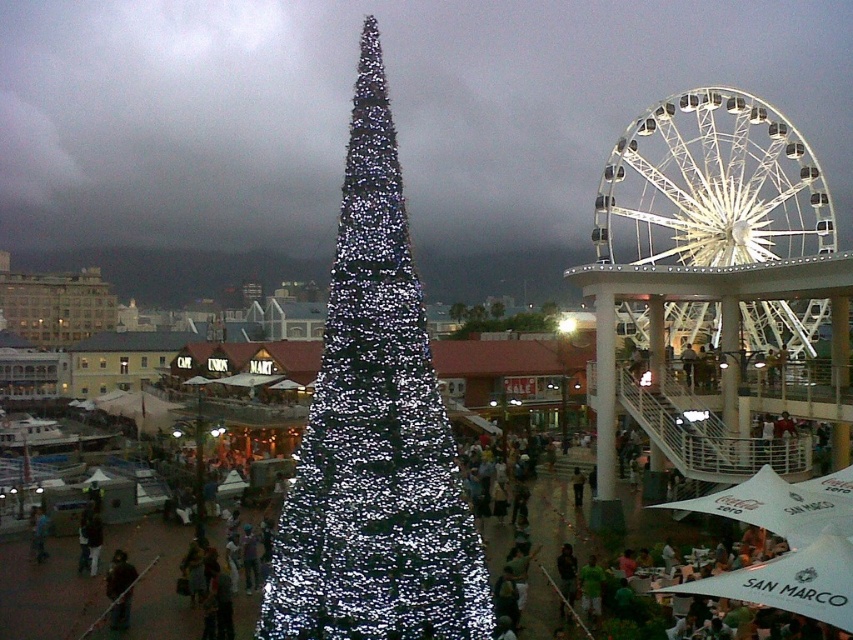
You are at the festive outdoor scene and want to take a photo of both the iridescent metallic christmas tree at center and the illuminated plastic tree at center. Which one should you aim your camera at first to capture both in the frame?

You should aim your camera at the iridescent metallic christmas tree at center first because it is located below the illuminated plastic tree at center, so adjusting the frame to include both would require starting from the lower position.

You are planning to take a photo of both the iridescent metallic christmas tree at center and the white metallic ferris wheel at upper right. Since you want both to be clearly visible in the frame, which object should you position closer to the camera to ensure both are in focus?

To ensure both the iridescent metallic christmas tree at center and the white metallic ferris wheel at upper right are clearly visible in focus, you should position the iridescent metallic christmas tree at center closer to the camera since it is smaller than the ferris wheel. This adjustment helps balance their sizes in the photo, making both appear appropriately scaled and in focus.